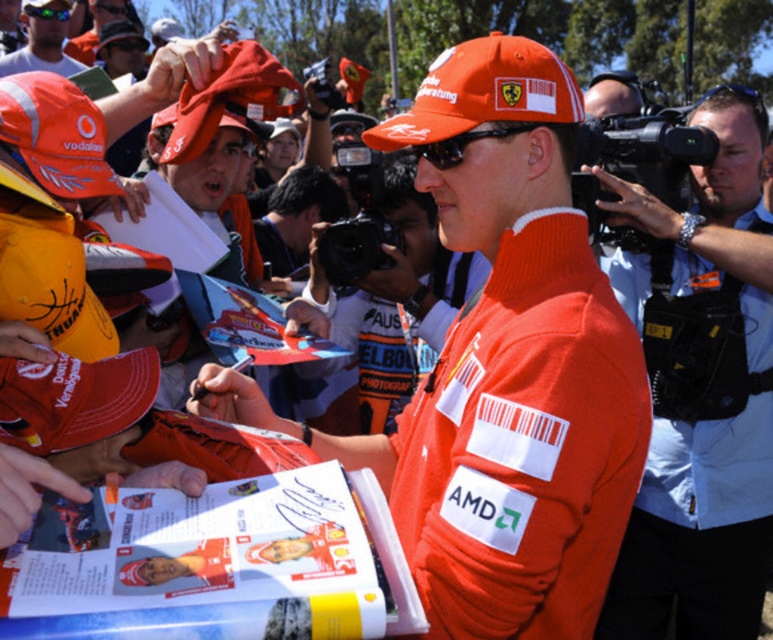
Question: Can you confirm if orange fabric shirt at right is smaller than orange fabric cap at upper left?

Choices:
 (A) no
 (B) yes

Answer: (B)

Question: Can you confirm if orange fabric shirt at right is positioned above orange matte cap at center?

Choices:
 (A) yes
 (B) no

Answer: (B)

Question: Observing the image, what is the correct spatial positioning of orange matte cap at center in reference to orange fabric cap at lower left?

Choices:
 (A) above
 (B) below

Answer: (A)

Question: Which point is closer to the camera taking this photo?

Choices:
 (A) (117, 432)
 (B) (569, 108)

Answer: (B)

Question: Which object is the closest to the orange fabric shirt at right?

Choices:
 (A) orange fabric cap at lower left
 (B) orange fabric cap at upper left

Answer: (A)

Question: Which of the following is the closest to the observer?

Choices:
 (A) orange matte cap at center
 (B) orange fabric shirt at right

Answer: (A)